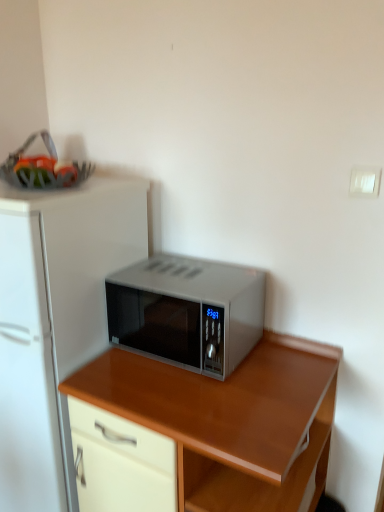
Where is `free space above satin silver microwave at center (from a real-world perspective)`? This screenshot has height=512, width=384. free space above satin silver microwave at center (from a real-world perspective) is located at coordinates (185, 272).